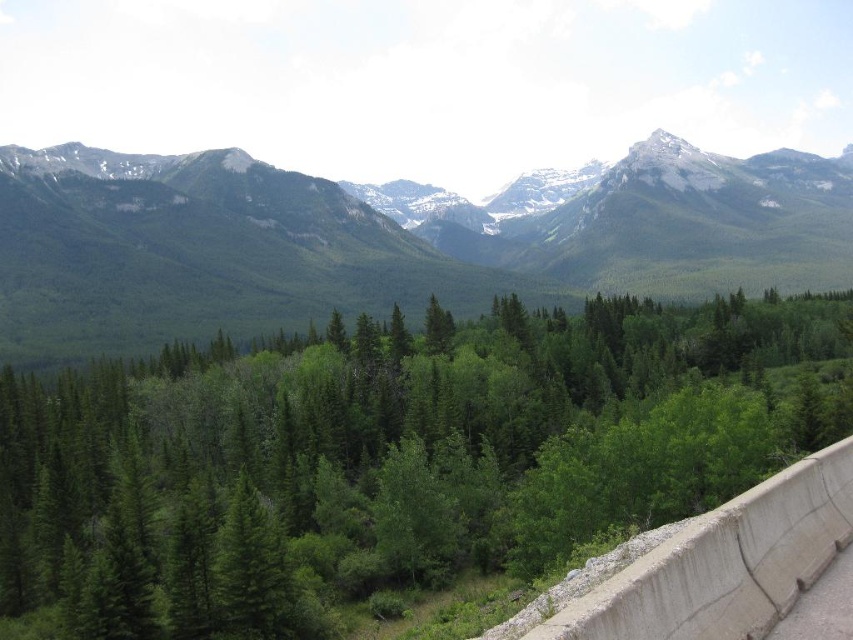
Question: Considering the relative positions of green leafy trees at center and green forested mountain range at center in the image provided, where is green leafy trees at center located with respect to green forested mountain range at center?

Choices:
 (A) right
 (B) left

Answer: (B)

Question: Among these objects, which one is nearest to the camera?

Choices:
 (A) gray concrete ledge at lower right
 (B) green leafy trees at center

Answer: (A)

Question: Does green leafy trees at center appear under green forested mountain range at center?

Choices:
 (A) yes
 (B) no

Answer: (A)

Question: Estimate the real-world distances between objects in this image. Which object is farther from the green leafy trees at center?

Choices:
 (A) gray concrete ledge at lower right
 (B) green forested mountain range at center

Answer: (B)

Question: Which of these objects is positioned farthest from the gray concrete ledge at lower right?

Choices:
 (A) green forested mountain range at center
 (B) green leafy trees at center

Answer: (A)

Question: Is green forested mountain range at center below gray concrete ledge at lower right?

Choices:
 (A) yes
 (B) no

Answer: (B)